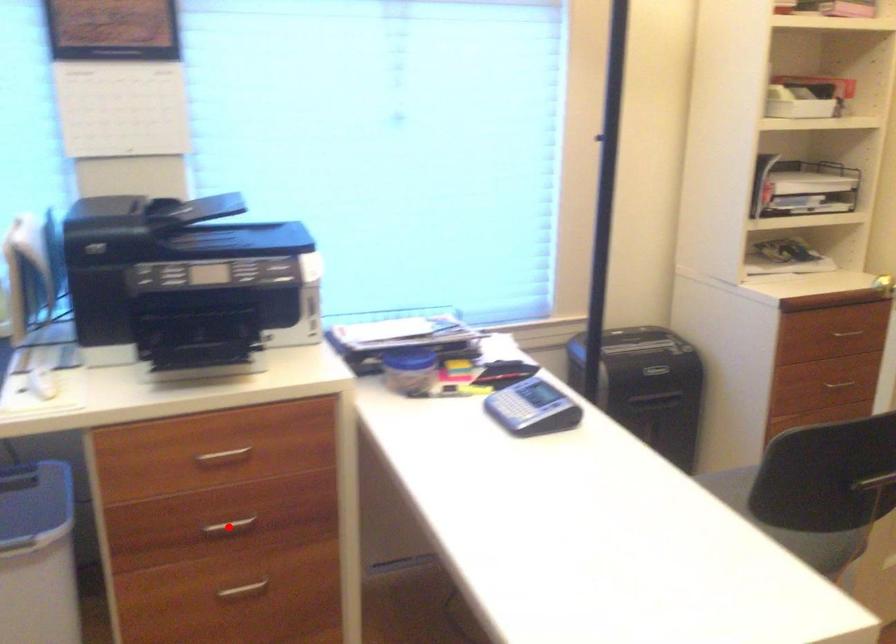
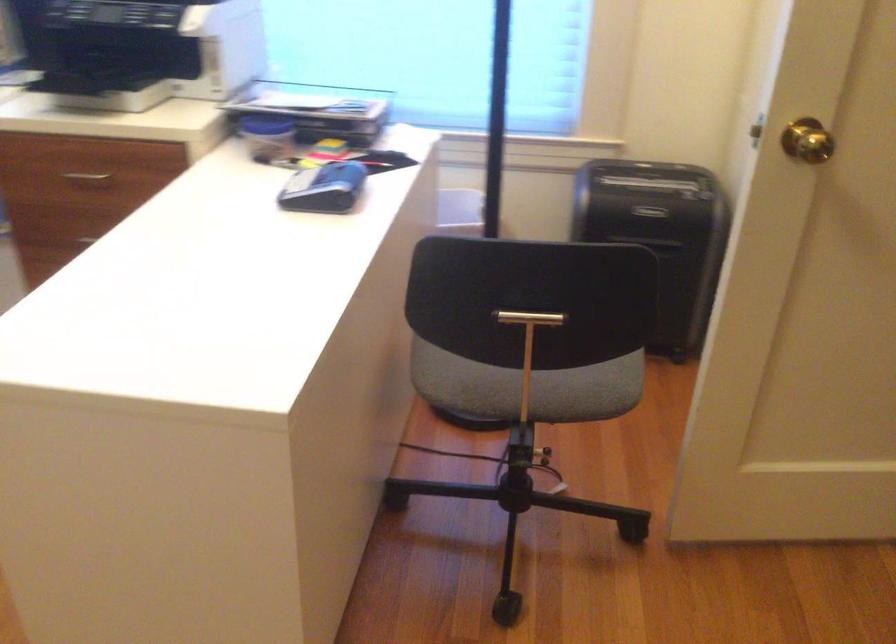
Question: I am providing you with two images of the same scene from different viewpoints. A red point is marked on the first image. Is the red point's position out of view in image 2?

Choices:
 (A) Yes
 (B) No

Answer: (A)